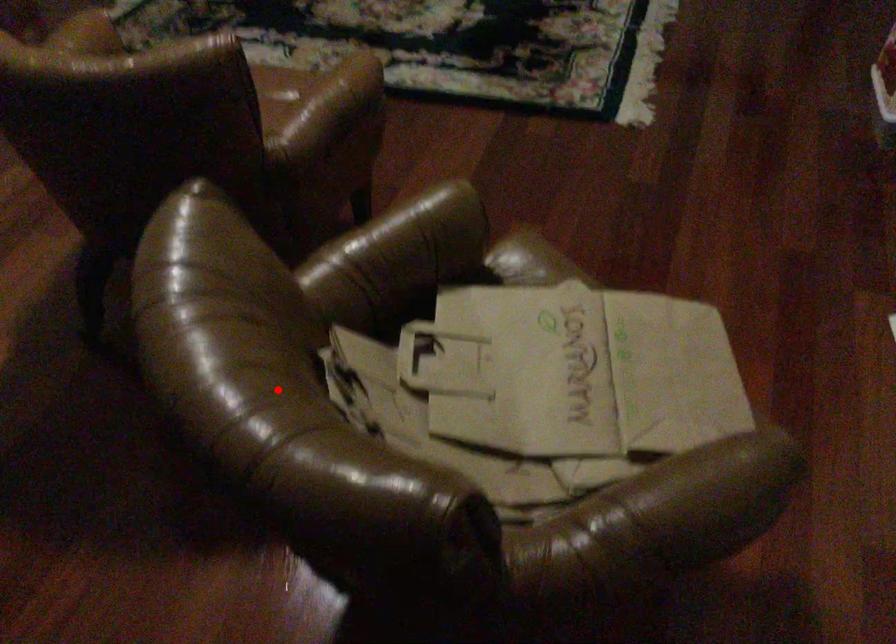
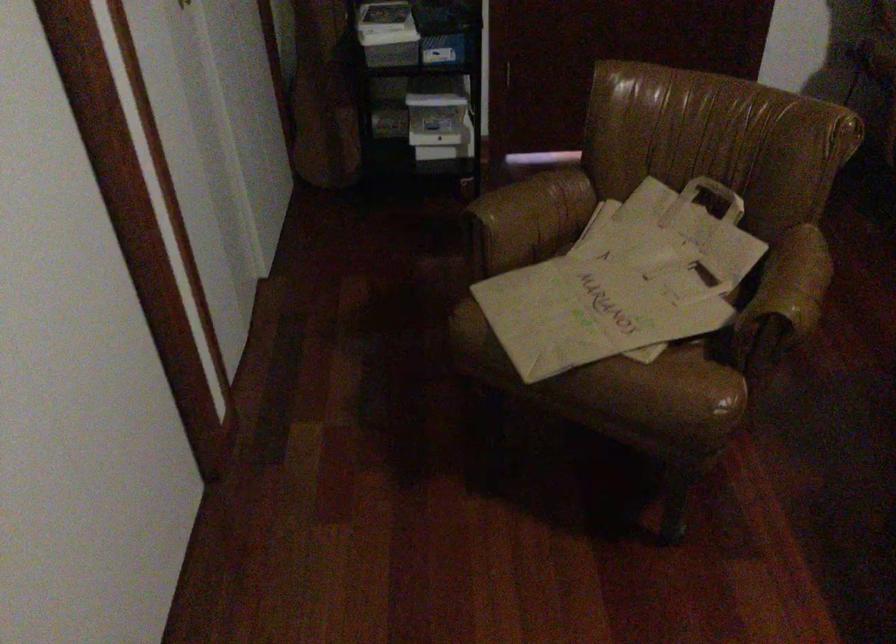
The point at the highlighted location is marked in the first image. Where is the corresponding point in the second image?

(716, 194)